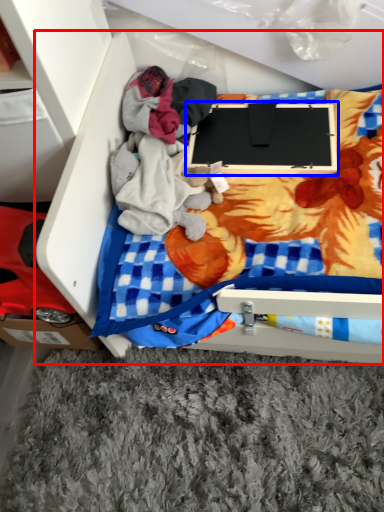
Question: Which point is further to the camera, furniture (highlighted by a red box) or laptop (highlighted by a blue box)?

Choices:
 (A) furniture
 (B) laptop

Answer: (B)